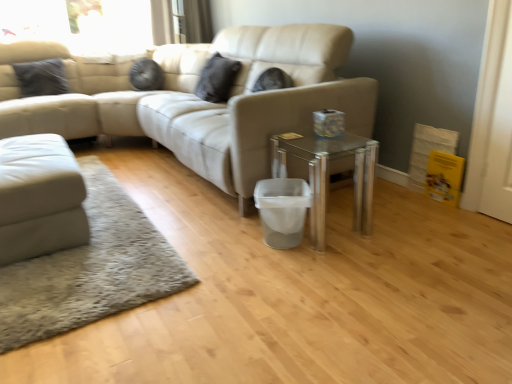
Question: From a real-world perspective, is transparent glass table at center below white wood screen door at right?

Choices:
 (A) yes
 (B) no

Answer: (A)

Question: Does transparent glass table at center have a greater width compared to white wood screen door at right?

Choices:
 (A) no
 (B) yes

Answer: (B)

Question: Is transparent glass table at center oriented towards white wood screen door at right?

Choices:
 (A) yes
 (B) no

Answer: (B)

Question: Is the depth of transparent glass table at center greater than that of white wood screen door at right?

Choices:
 (A) no
 (B) yes

Answer: (B)

Question: Is transparent glass table at center in contact with white wood screen door at right?

Choices:
 (A) no
 (B) yes

Answer: (A)

Question: From the image's perspective, is transparent glass table at center located above white wood screen door at right?

Choices:
 (A) no
 (B) yes

Answer: (A)

Question: Can you confirm if matte black pillow at upper center, marked as the first pillow in a right-to-left arrangement, is positioned to the right of white wood screen door at right?

Choices:
 (A) no
 (B) yes

Answer: (A)

Question: Is matte black pillow at upper center, the 2th pillow in the left-to-right sequence, closer to camera compared to white wood screen door at right?

Choices:
 (A) no
 (B) yes

Answer: (A)

Question: Is matte black pillow at upper center, marked as the first pillow in a right-to-left arrangement, facing away from white wood screen door at right?

Choices:
 (A) yes
 (B) no

Answer: (B)

Question: Considering the relative positions of matte black pillow at upper center, the 2th pillow in the left-to-right sequence, and white wood screen door at right in the image provided, is matte black pillow at upper center, the 2th pillow in the left-to-right sequence, to the left of white wood screen door at right from the viewer's perspective?

Choices:
 (A) yes
 (B) no

Answer: (A)

Question: Is matte black pillow at upper center, the 2th pillow in the left-to-right sequence, facing towards white wood screen door at right?

Choices:
 (A) yes
 (B) no

Answer: (B)

Question: Are matte black pillow at upper center, the 2th pillow in the left-to-right sequence, and white wood screen door at right far apart?

Choices:
 (A) yes
 (B) no

Answer: (A)

Question: Considering the relative sizes of white wood screen door at right and matte black pillow at upper center, marked as the first pillow in a right-to-left arrangement, in the image provided, is white wood screen door at right shorter than matte black pillow at upper center, marked as the first pillow in a right-to-left arrangement,?

Choices:
 (A) yes
 (B) no

Answer: (B)